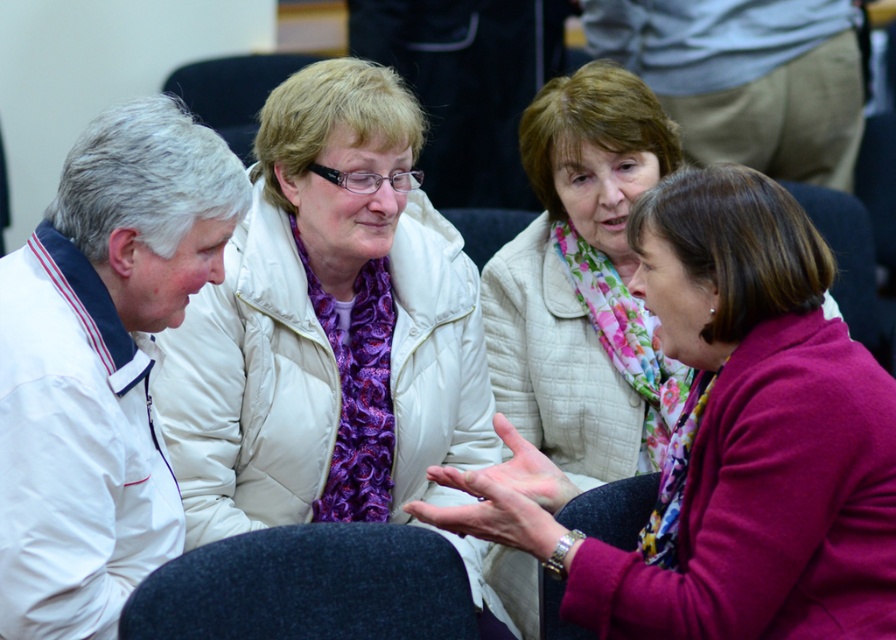
You are organizing a small event and need to place a decorative item between the floral scarf at center and the white quilted jacket at upper center. Considering their sizes, which object should you place closer to the smaller one to maintain balance?

The white quilted jacket at upper center is smaller in width than the floral scarf at center, so you should place the decorative item closer to the white quilted jacket at upper center to balance the sizes.

Based on the photo, you are a photographer trying to capture a closeup of both the floral scarf at center and the white quilted jacket at upper center in the image. Given that your camera lens has a depth of field that can focus on objects within a 15 inch range, will you be able to get both items in focus at the same time?

The floral scarf at center and white quilted jacket at upper center are 17.95 inches apart, which exceeds the 15 inch range of the camera lens depth of field. Therefore, both items cannot be in focus simultaneously.